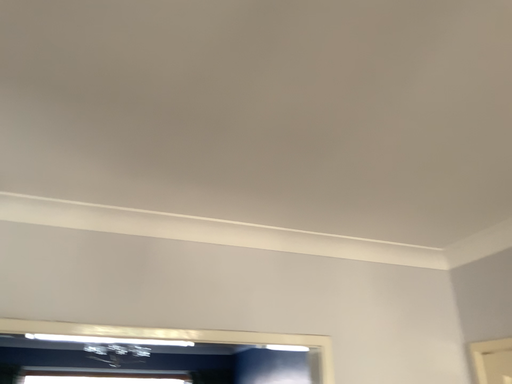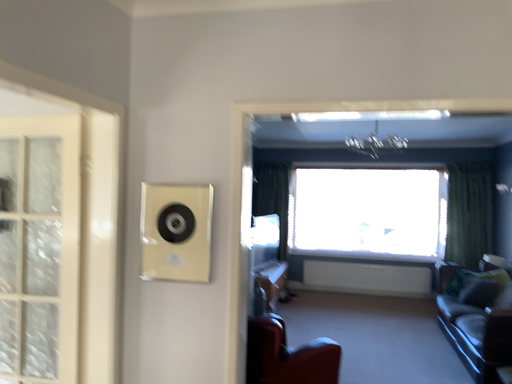
Question: Which way did the camera rotate in the video?

Choices:
 (A) rotated right
 (B) rotated left

Answer: (B)